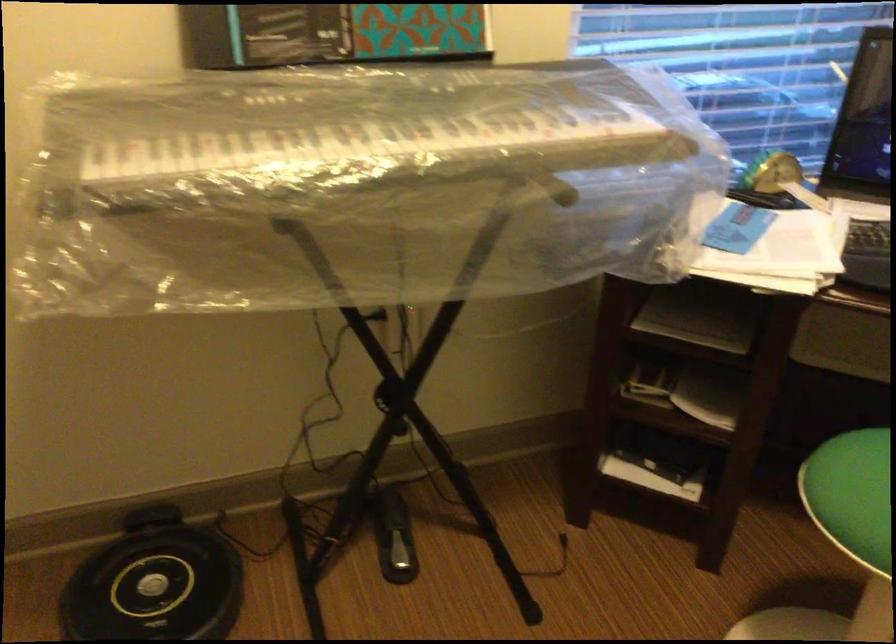
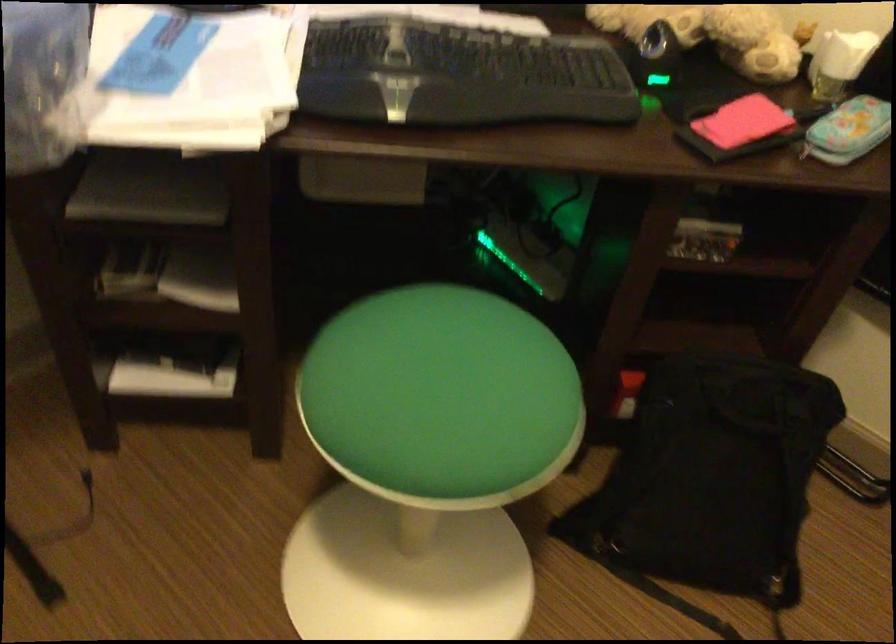
Looking at this image, the first image is from the beginning of the video and the second image is from the end. How did the camera likely rotate when shooting the video?

The camera's rotation is toward right-down.